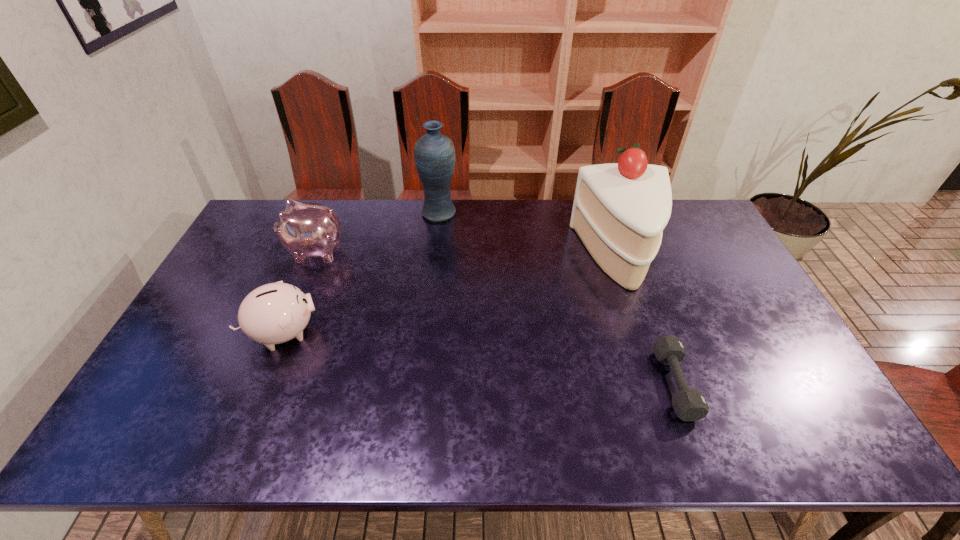
Find the location of `free space between the farther piggy bank and the farthest object`. free space between the farther piggy bank and the farthest object is located at coordinates (377, 232).

The image size is (960, 540). I want to click on object that is the closest to the dumbbell, so click(619, 212).

Identify which object is the fourth nearest to the dumbbell. Please provide its 2D coordinates. Your answer should be formatted as a tuple, i.e. [(x, y)], where the tuple contains the x and y coordinates of a point satisfying the conditions above.

[(306, 230)]

Find the location of `vacant space that satisfies the following two spatial constraints: 1. on the front facing side of the farther piggy bank; 2. on the back side of the cake`. vacant space that satisfies the following two spatial constraints: 1. on the front facing side of the farther piggy bank; 2. on the back side of the cake is located at coordinates 313,256.

Locate an element on the screen. The image size is (960, 540). vacant position in the image that satisfies the following two spatial constraints: 1. on the front facing side of the farther piggy bank; 2. on the back side of the cake is located at coordinates (313, 256).

This screenshot has height=540, width=960. Identify the location of free location that satisfies the following two spatial constraints: 1. on the front facing side of the farther piggy bank; 2. on the back side of the cake. (313, 256).

The height and width of the screenshot is (540, 960). What are the coordinates of `vacant space that satisfies the following two spatial constraints: 1. on the front facing side of the cake; 2. on the right side of the farther piggy bank` in the screenshot? It's located at (313, 256).

Where is `free spot that satisfies the following two spatial constraints: 1. on the back side of the cake; 2. on the left side of the nearer piggy bank`? free spot that satisfies the following two spatial constraints: 1. on the back side of the cake; 2. on the left side of the nearer piggy bank is located at coordinates (315, 256).

Locate an element on the screen. vacant area that satisfies the following two spatial constraints: 1. on the front facing side of the shortest object; 2. on the left side of the farther piggy bank is located at coordinates (260, 384).

The image size is (960, 540). Identify the location of free location that satisfies the following two spatial constraints: 1. on the front facing side of the farther piggy bank; 2. on the left side of the cake. (313, 256).